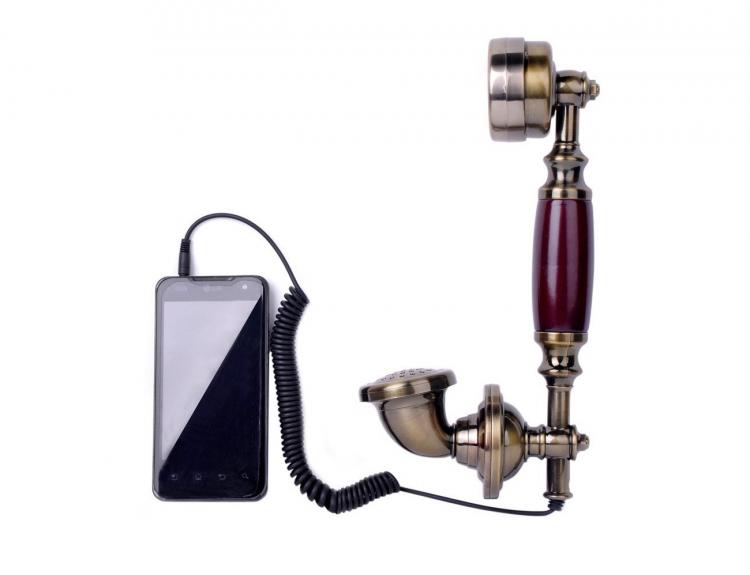
Image resolution: width=750 pixels, height=575 pixels. I want to click on black cord, so click(298, 386).